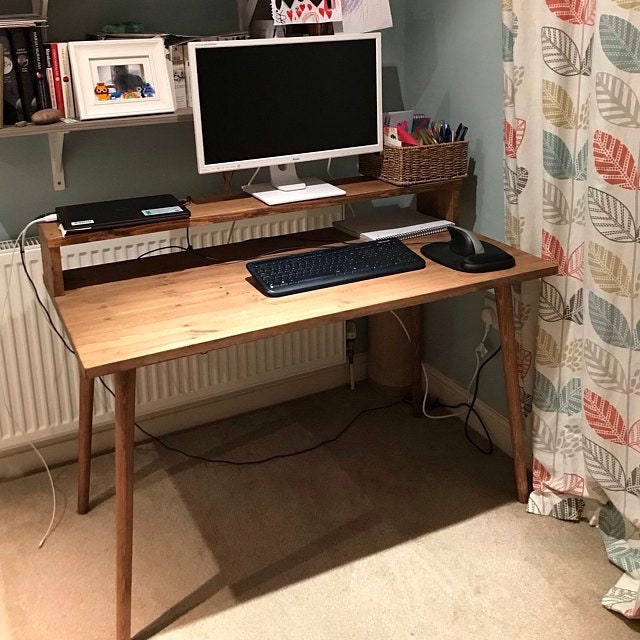
You are a GUI agent. You are given a task and a screenshot of the screen. Output one action in this format:
    pyautogui.click(x=<x>, y=<y>)
    Task: Click on the socket
    Image resolution: width=640 pixels, height=640 pixels.
    Given the screenshot: What is the action you would take?
    pyautogui.click(x=488, y=323)